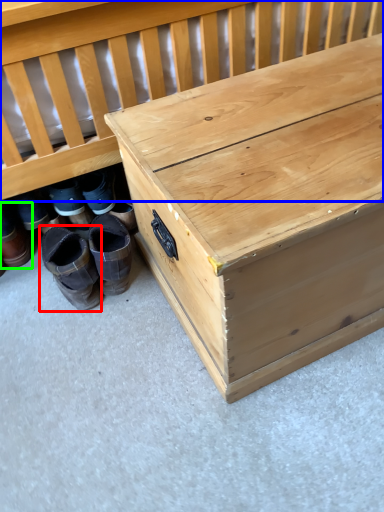
Question: Considering the real-world distances, which object is closest to footwear (highlighted by a red box)? infant bed (highlighted by a blue box) or footwear (highlighted by a green box).

Choices:
 (A) infant bed
 (B) footwear

Answer: (B)